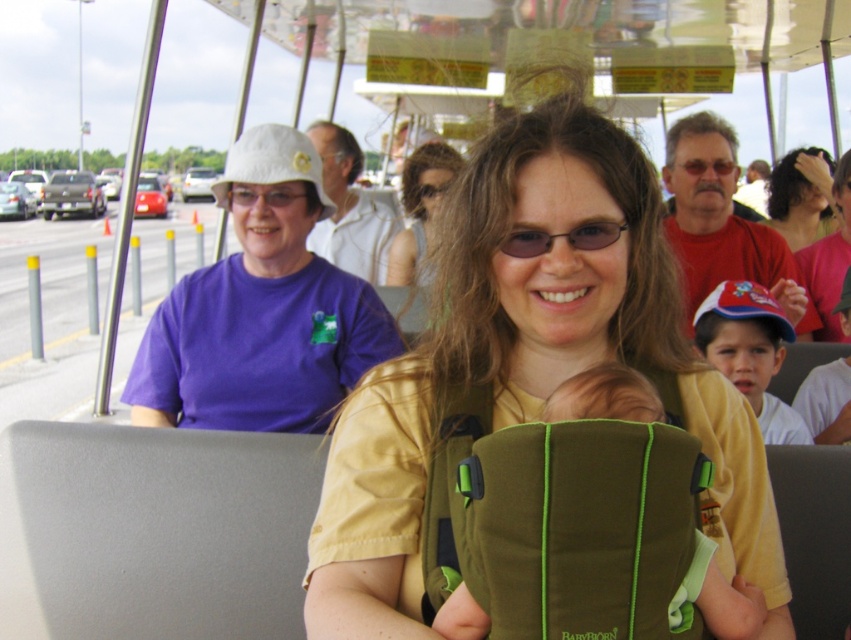
You are standing in the fairground and see the red cotton shirt at upper right and the white fabric coach at upper center. Which object is nearer to you?

The red cotton shirt at upper right is closer to the viewer than the white fabric coach at upper center.

You are a photographer trying to capture a photo of the matte yellow shirt at center and the red cotton shirt at upper right. Which shirt should you zoom in on to ensure both shirts are fully visible in the frame?

The matte yellow shirt at center occupies less space than the red cotton shirt at upper right, so you should zoom in on the red cotton shirt at upper right to ensure both shirts are fully visible in the frame.